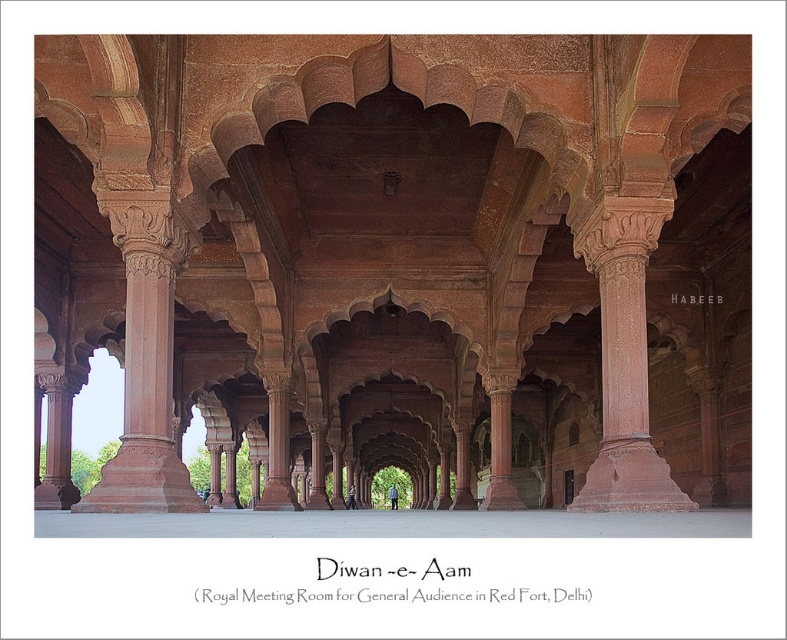
Does red sandstone arches at center lie behind rustic stone column at center?

Yes, it is.

Does point (274, 348) lie in front of point (597, 280)?

No, it is behind (597, 280).

Who is more forward, (316, 426) or (656, 499)?

Positioned in front is point (656, 499).

At what (x,y) coordinates should I click in order to perform the action: click on red sandstone arches at center. Please return your answer as a coordinate pair (x, y). This screenshot has width=787, height=640. Looking at the image, I should click on (388, 209).